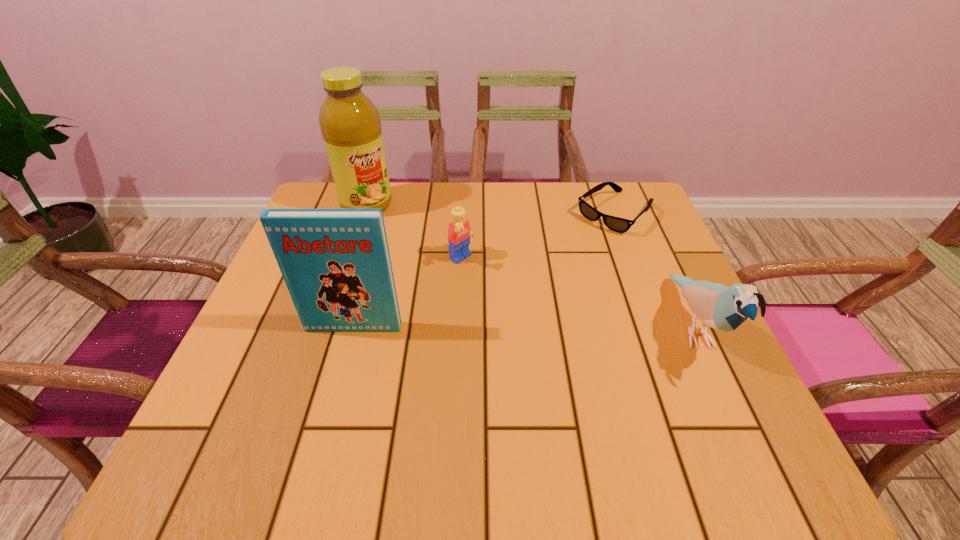
The image size is (960, 540). In order to click on book present at the left edge in this screenshot , I will do `click(336, 264)`.

Where is `fruit juice that is at the left edge`? fruit juice that is at the left edge is located at coordinates (350, 124).

Find the location of a particular element. The image size is (960, 540). bird that is at the right edge is located at coordinates (720, 307).

Where is `sunglasses located in the right edge section of the desktop`? The image size is (960, 540). sunglasses located in the right edge section of the desktop is located at coordinates (617, 224).

The height and width of the screenshot is (540, 960). I want to click on object positioned at the far left corner, so click(x=350, y=124).

This screenshot has width=960, height=540. I want to click on object that is at the far right corner, so click(x=617, y=224).

Where is `object that is at the near right corner`? Image resolution: width=960 pixels, height=540 pixels. object that is at the near right corner is located at coordinates (720, 307).

Find the location of a particular element. free space at the far edge of the desktop is located at coordinates (530, 218).

At what (x,y) coordinates should I click in order to perform the action: click on free space at the left edge. Please return your answer as a coordinate pair (x, y). Looking at the image, I should click on (273, 352).

Where is `vacant space at the right edge`? vacant space at the right edge is located at coordinates (678, 333).